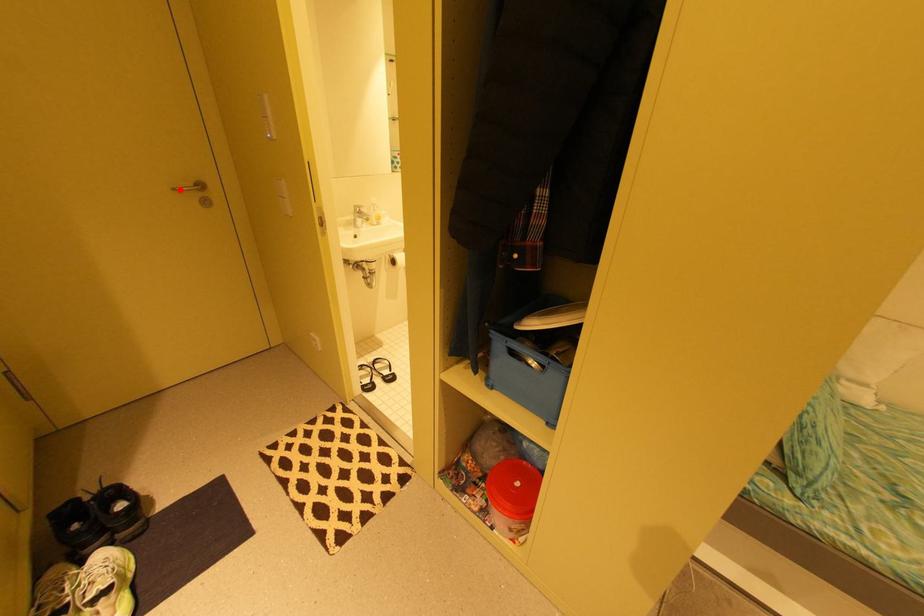
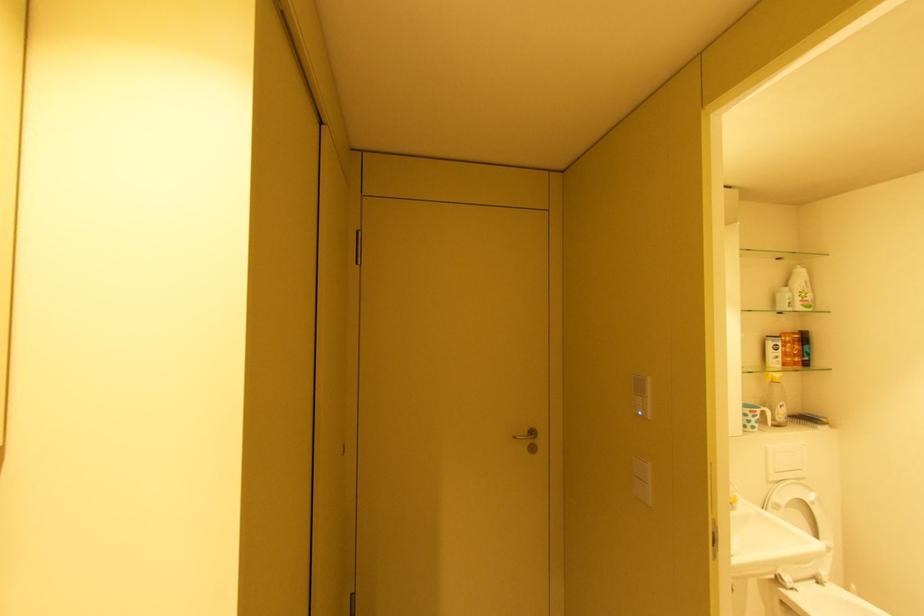
Locate, in the second image, the point that corresponds to the highlighted location in the first image.

(520, 438)